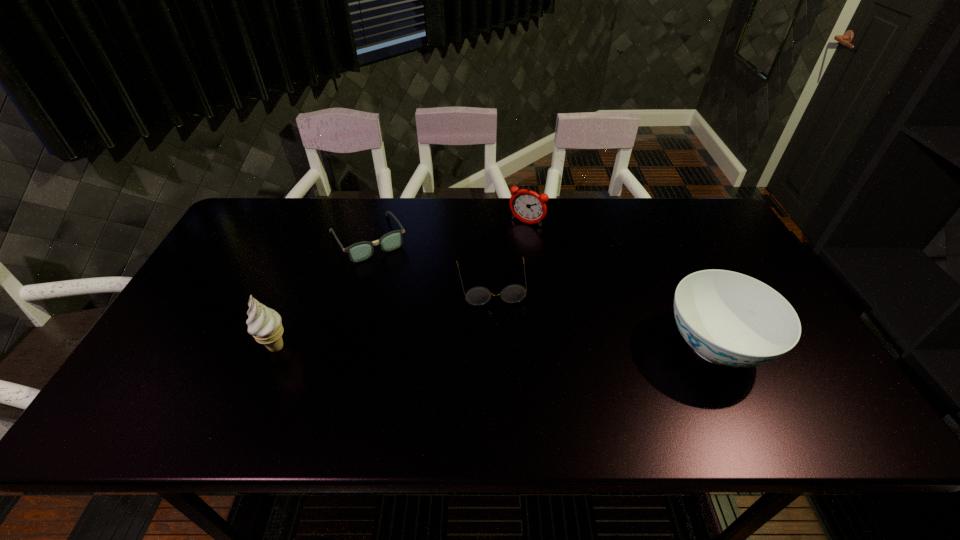
Locate an element on the screen. The height and width of the screenshot is (540, 960). vacant spot on the desktop that is between the icecream and the chinaware and is positioned on the face of the left spectacles is located at coordinates (431, 346).

Identify the location of vacant spot on the desktop that is between the icecream and the rightmost object and is positioned on the front-facing side of the alarm clock. (444, 346).

This screenshot has height=540, width=960. Find the location of `vacant spot on the desktop that is between the tallest object and the chinaware and is positioned on the temples of the right spectacles`. vacant spot on the desktop that is between the tallest object and the chinaware and is positioned on the temples of the right spectacles is located at coordinates (499, 346).